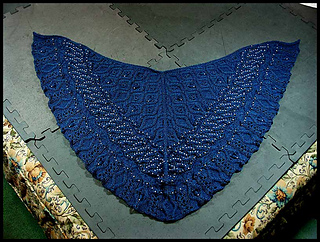
At what (x,y) coordinates should I click in order to perform the action: click on floor. Please return your answer as a coordinate pair (x, y). Looking at the image, I should click on (58, 201).